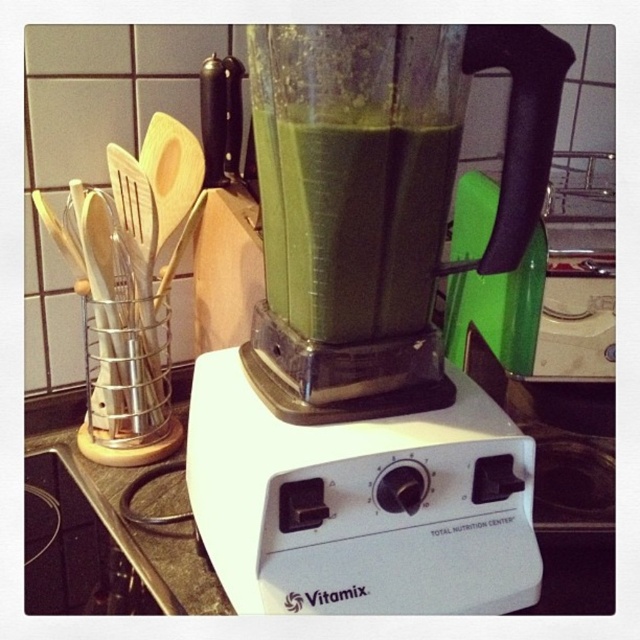
Question: Can you confirm if translucent plastic blender at center is positioned to the left of white plastic countertop at center?

Choices:
 (A) yes
 (B) no

Answer: (B)

Question: Can you confirm if green smoothie at center is thinner than white plastic countertop at center?

Choices:
 (A) no
 (B) yes

Answer: (B)

Question: Is the position of translucent plastic blender at center more distant than that of white plastic countertop at center?

Choices:
 (A) yes
 (B) no

Answer: (B)

Question: Which point is farther from the camera taking this photo?

Choices:
 (A) (429, 129)
 (B) (340, 144)
 (C) (605, 436)

Answer: (C)

Question: Which object appears closest to the camera in this image?

Choices:
 (A) green smoothie at center
 (B) white plastic countertop at center
 (C) translucent plastic blender at center

Answer: (C)

Question: Which object appears farthest from the camera in this image?

Choices:
 (A) green smoothie at center
 (B) white plastic countertop at center

Answer: (B)